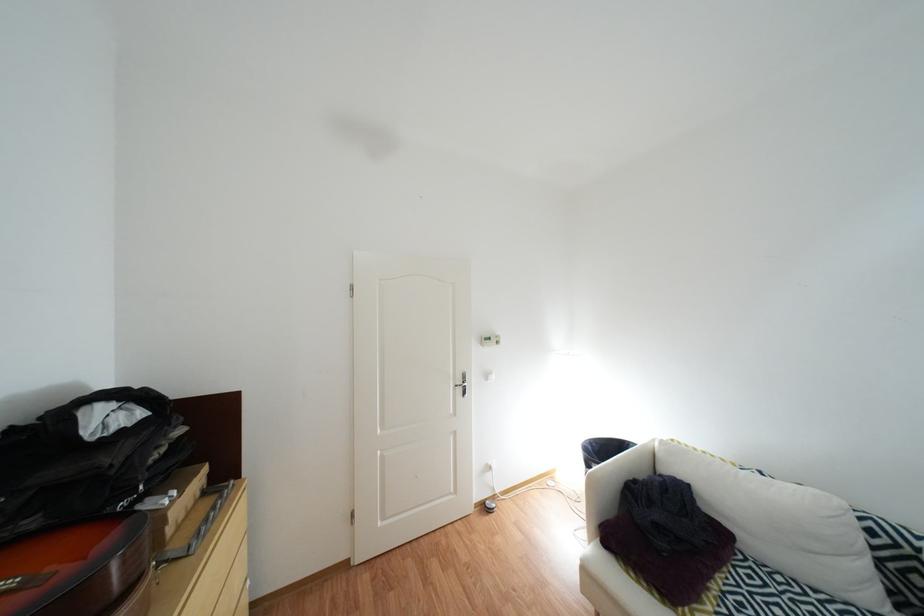
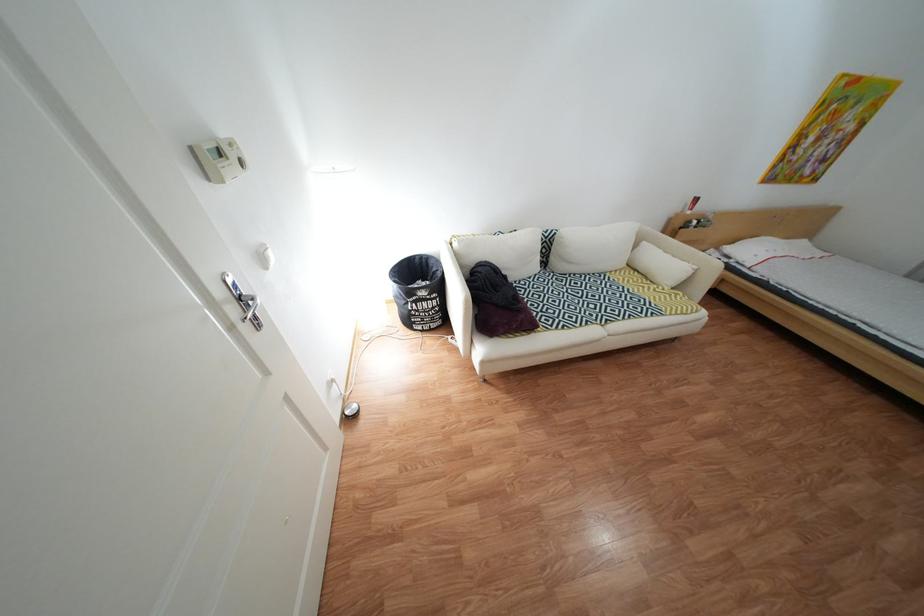
Locate, in the second image, the point that corresponds to the point at 756,546 in the first image.

(525, 281)